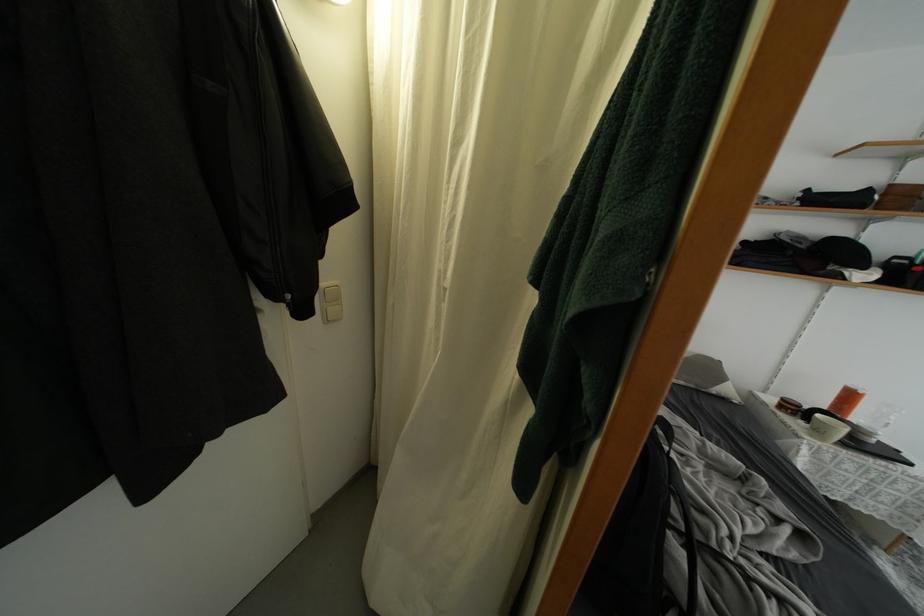
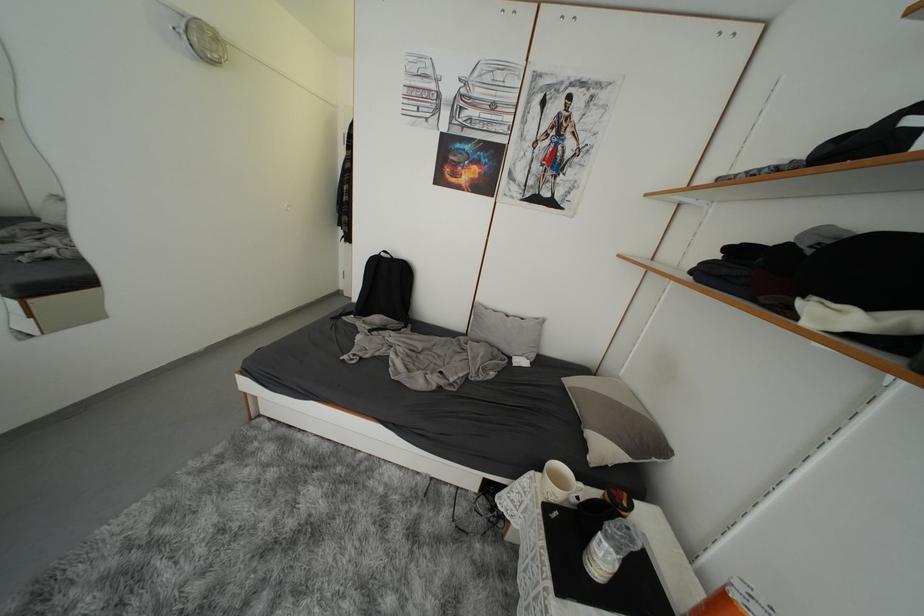
Question: I am providing you with two images of the same scene from different viewpoints. After the viewpoint changes to image2, which objects are now occluded?

Choices:
 (A) cabinet door cutout
 (B) jacket zipper pull
 (C) red locking lever
 (D) gray pillow

Answer: (B)